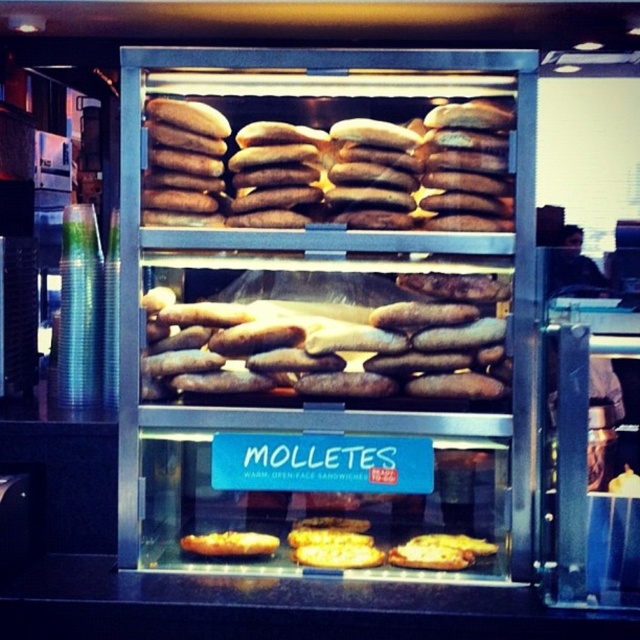
Does brown matte bread at center have a lesser height compared to golden brown bread at lower center?

No, brown matte bread at center is not shorter than golden brown bread at lower center.

Between brown matte bread at center and golden brown bread at lower center, which one has less height?

Standing shorter between the two is golden brown bread at lower center.

Is point (413, 186) closer to viewer compared to point (195, 541)?

Yes, it is in front of point (195, 541).

You are a GUI agent. You are given a task and a screenshot of the screen. Output one action in this format:
    pyautogui.click(x=<x>, y=<y>)
    Task: Click on the brown matte bread at center
    The image size is (640, 640).
    Given the screenshot: What is the action you would take?
    pyautogui.click(x=365, y=177)

Which of these two, brown matte bread at center or brown matte baguette at center, stands shorter?

brown matte baguette at center

Which is behind, point (476, 170) or point (413, 326)?

The point (413, 326) is more distant.

Locate an element on the screen. This screenshot has height=640, width=640. brown matte bread at center is located at coordinates (365, 177).

Can you confirm if brown matte baguette at center is thinner than golden brown bread at lower center?

In fact, brown matte baguette at center might be wider than golden brown bread at lower center.

Does point (257, 301) come farther from viewer compared to point (195, 536)?

Yes, point (257, 301) is behind point (195, 536).

Is point (296, 324) closer to viewer compared to point (224, 532)?

That is True.

Identify the location of brown matte baguette at center. (324, 348).